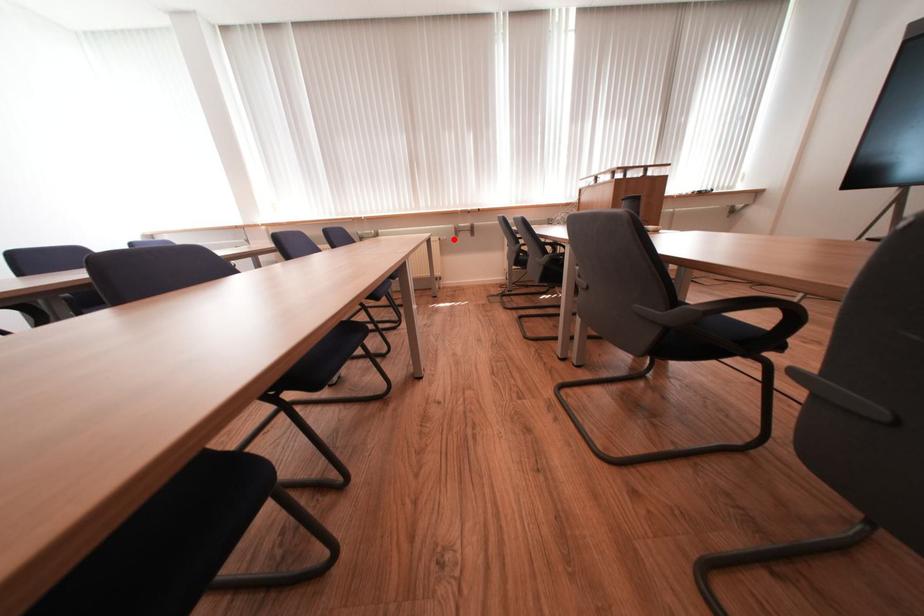
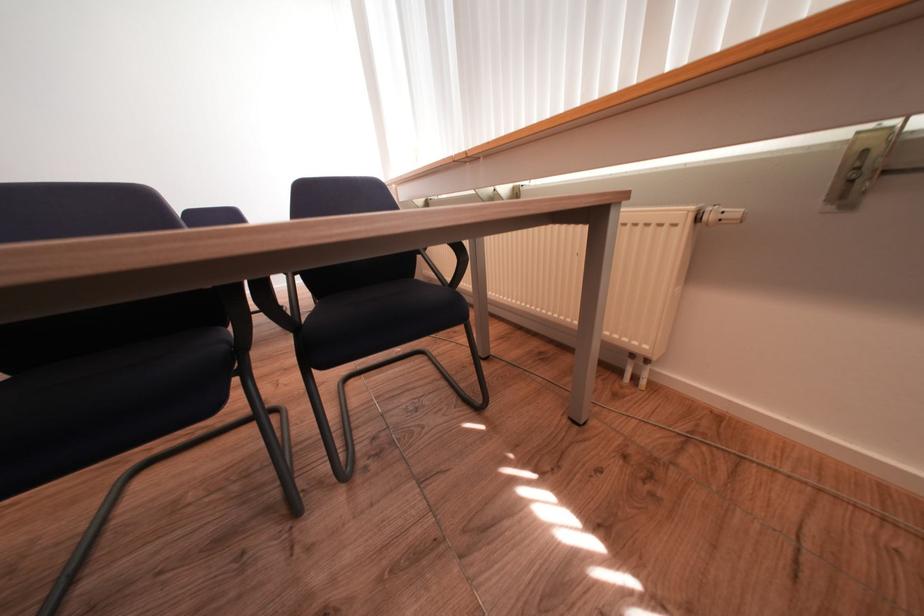
Where in the second image is the point corresponding to the highlighted location from the first image?

(745, 215)